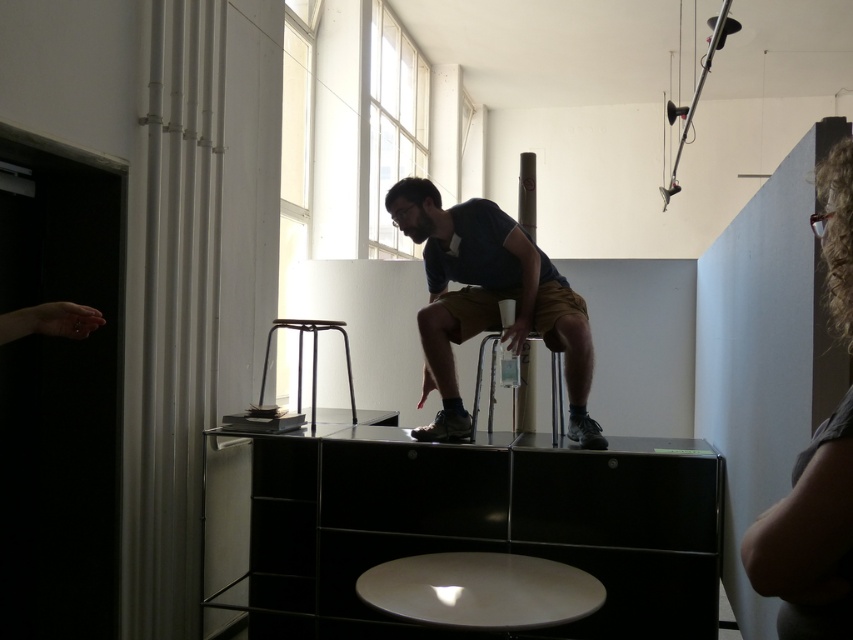
Question: Which object appears farthest from the camera in this image?

Choices:
 (A) matte blue shirt at center
 (B) metallic black stool at lower center

Answer: (B)

Question: Which object is farther from the camera taking this photo?

Choices:
 (A) matte blue shirt at center
 (B) curly hair at upper right
 (C) metallic silver bar stool at center

Answer: (C)

Question: Can you confirm if glossy black dresser at center is positioned below matte blue shirt at center?

Choices:
 (A) no
 (B) yes

Answer: (B)

Question: Which is farther from the glossy black dresser at center?

Choices:
 (A) metallic black stool at lower center
 (B) matte blue shirt at center

Answer: (A)

Question: Is the position of matte blue shirt at center more distant than that of metallic silver bar stool at center?

Choices:
 (A) no
 (B) yes

Answer: (A)

Question: Can you confirm if matte blue shirt at center is smaller than metallic silver bar stool at center?

Choices:
 (A) no
 (B) yes

Answer: (B)